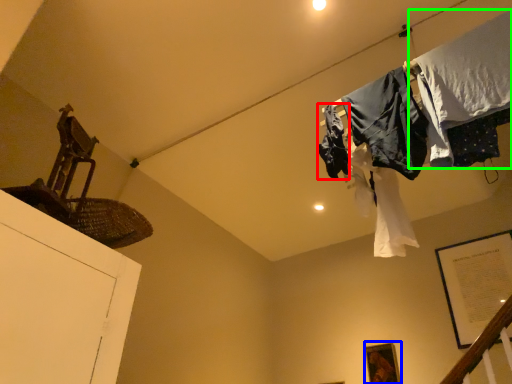
Question: Considering the real-world distances, which object is farthest from clothing (highlighted by a red box)? picture frame (highlighted by a blue box) or clothing (highlighted by a green box)?

Choices:
 (A) picture frame
 (B) clothing

Answer: (A)